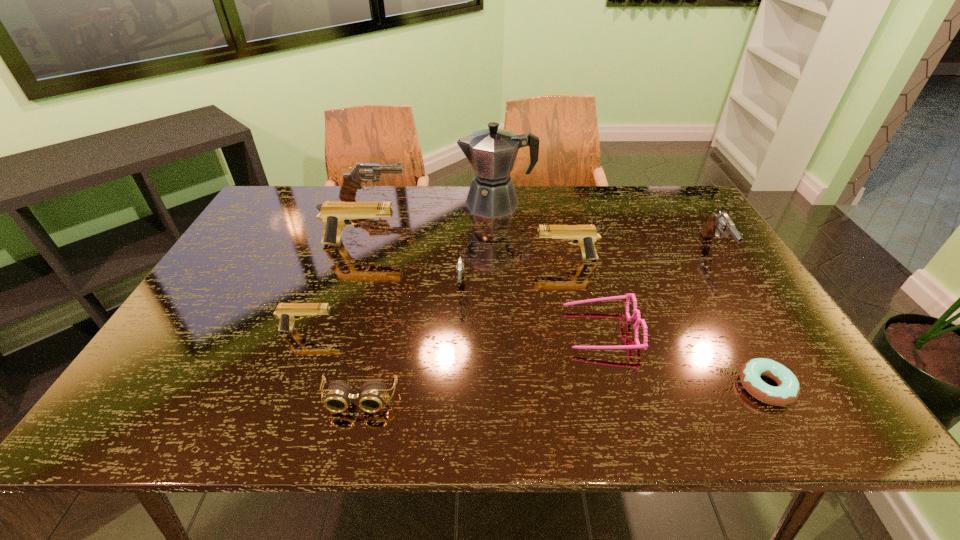
Where is `coffeepot`? The image size is (960, 540). coffeepot is located at coordinates (492, 152).

In order to click on the biggest gray pistol in this screenshot , I will do `click(363, 172)`.

The image size is (960, 540). I want to click on the farthest pistol, so click(363, 172).

At what (x,y) coordinates should I click in order to perform the action: click on the biggest tan pistol. Please return your answer as a coordinate pair (x, y). Looking at the image, I should click on (335, 215).

What are the coordinates of `the second farthest gray pistol` in the screenshot? It's located at (722, 223).

This screenshot has width=960, height=540. In order to click on the rightmost pistol in this screenshot , I will do `click(722, 223)`.

Find the location of a particular element. the fifth pistol from left to right is located at coordinates (585, 236).

What are the coordinates of `the second smallest tan pistol` in the screenshot? It's located at (585, 236).

You are a GUI agent. You are given a task and a screenshot of the screen. Output one action in this format:
    pyautogui.click(x=<x>, y=<y>)
    Task: Click on the fourth pistol from left to right
    This screenshot has width=960, height=540.
    Given the screenshot: What is the action you would take?
    pyautogui.click(x=460, y=266)

Image resolution: width=960 pixels, height=540 pixels. Find the location of `the nearest gray pistol`. the nearest gray pistol is located at coordinates (460, 266).